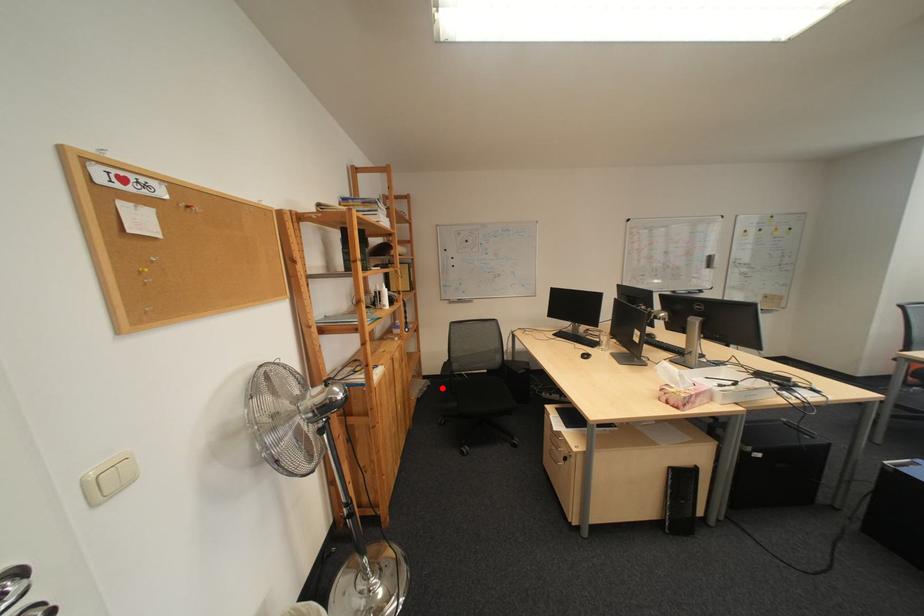
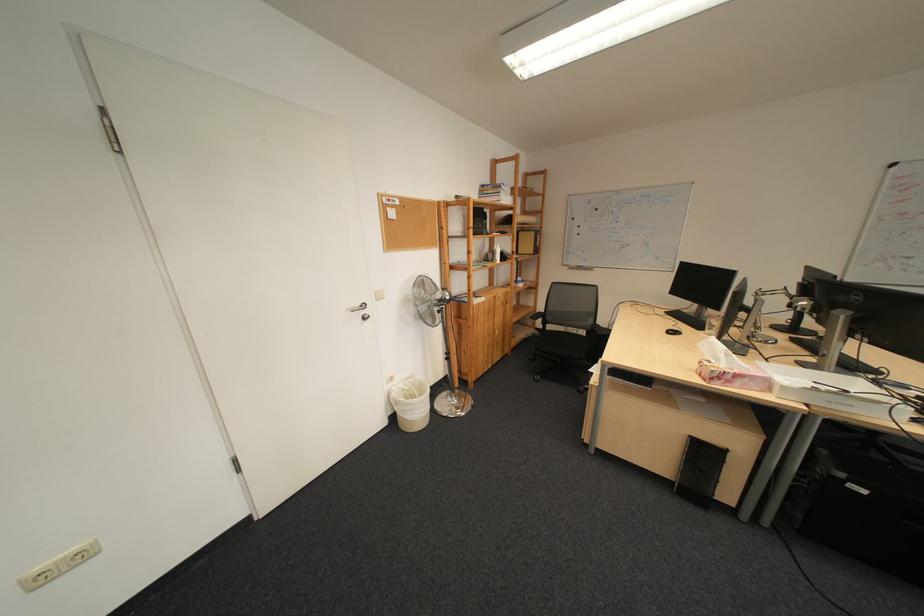
Question: I am providing you with two images of the same scene from different viewpoints. Given a red point in image1, look at the same physical point in image2. Is it:

Choices:
 (A) Closer to the viewpoint
 (B) Farther from the viewpoint

Answer: (A)